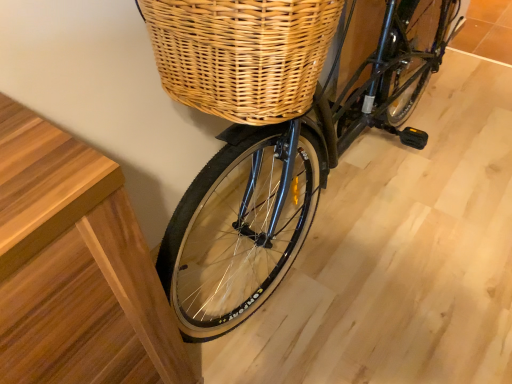
Question: Should I look upward or downward to see black matte bicycle at center?

Choices:
 (A) down
 (B) up

Answer: (B)